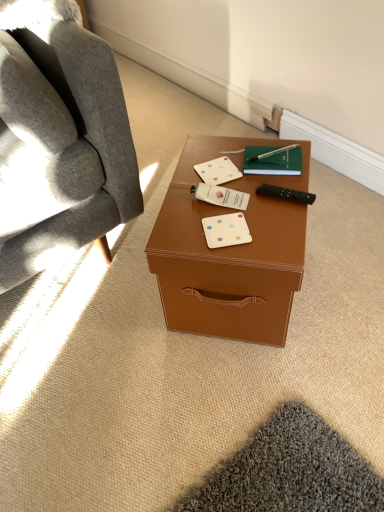
Locate an element on the screen. white matte business card at center, positioned as the second business card in front-to-back order is located at coordinates (221, 196).

This screenshot has width=384, height=512. In order to click on brown leather desk at center in this screenshot , I will do `click(229, 253)`.

This screenshot has height=512, width=384. Describe the element at coordinates (229, 253) in the screenshot. I see `brown leather desk at center` at that location.

The image size is (384, 512). What do you see at coordinates (226, 230) in the screenshot? I see `white matte business card at center, the 3th business card when ordered from back to front` at bounding box center [226, 230].

Identify the location of soft gray fabric chair at left. (59, 140).

Find the location of a particular element. This screenshot has height=512, width=384. green matte notebook at center is located at coordinates (272, 161).

The height and width of the screenshot is (512, 384). I want to click on white matte business card at center, marked as the 2th business card in a back-to-front arrangement, so click(221, 196).

In the image, there is a white matte business card at center, marked as the 2th business card in a back-to-front arrangement. Identify the location of business card above it (from the image's perspective). This screenshot has height=512, width=384. coord(218,170).

Considering their positions, is white matte business card at center, marked as the 2th business card in a back-to-front arrangement, located in front of or behind white matte business card at center, which ranks as the first business card in back-to-front order?

white matte business card at center, marked as the 2th business card in a back-to-front arrangement, is positioned closer to the viewer than white matte business card at center, which ranks as the first business card in back-to-front order.

Consider the image. Is white matte business card at center, the second business card in the top-to-bottom sequence, positioned with its back to white matte business card at center, which ranks as the first business card in back-to-front order?

That's right, white matte business card at center, the second business card in the top-to-bottom sequence, is facing away from white matte business card at center, which ranks as the first business card in back-to-front order.

Could you measure the distance between white matte business card at center, positioned as the second business card in front-to-back order, and white matte business card at center, marked as the first business card in a top-to-bottom arrangement?

2.43 inches.

Considering the points (14, 69) and (208, 255), which point is behind, point (14, 69) or point (208, 255)?

Point (208, 255)

Is brown leather desk at center inside soft gray fabric chair at left?

No, brown leather desk at center is not inside soft gray fabric chair at left.

In terms of width, does soft gray fabric chair at left look wider or thinner when compared to brown leather desk at center?

In the image, soft gray fabric chair at left appears to be wider than brown leather desk at center.

Could you tell me if soft gray fabric chair at left is facing brown leather desk at center?

Yes, soft gray fabric chair at left is facing brown leather desk at center.

Between soft gray fabric chair at left and black plastic remote control at right, which one is positioned behind?

black plastic remote control at right is further away from the camera.

Who is smaller, soft gray fabric chair at left or black plastic remote control at right?

Smaller between the two is black plastic remote control at right.

Does point (36, 52) lie in front of point (279, 186)?

That is True.

Is soft gray fabric chair at left in contact with black plastic remote control at right?

No, soft gray fabric chair at left is not with black plastic remote control at right.

Can you see white matte business card at center, the 3th business card when ordered from back to front, touching soft gray fabric chair at left?

No, white matte business card at center, the 3th business card when ordered from back to front, is not making contact with soft gray fabric chair at left.

From a real-world perspective, does white matte business card at center, the 1th business card viewed from the front, sit lower than soft gray fabric chair at left?

Indeed, from a real-world perspective, white matte business card at center, the 1th business card viewed from the front, is positioned beneath soft gray fabric chair at left.

Consider the image. Is white matte business card at center, which is counted as the first business card, starting from the bottom, positioned behind soft gray fabric chair at left?

Yes, it is.

Is soft gray fabric chair at left located within white matte business card at center, the 1th business card viewed from the front?

No, soft gray fabric chair at left is not inside white matte business card at center, the 1th business card viewed from the front.

Is soft gray fabric chair at left at the back of black plastic remote control at right?

No, black plastic remote control at right is not facing away from soft gray fabric chair at left.

Can you confirm if black plastic remote control at right is smaller than soft gray fabric chair at left?

Correct, black plastic remote control at right occupies less space than soft gray fabric chair at left.

Between black plastic remote control at right and soft gray fabric chair at left, which one is positioned in front?

Positioned in front is soft gray fabric chair at left.

Are black plastic remote control at right and soft gray fabric chair at left making contact?

No, black plastic remote control at right is not making contact with soft gray fabric chair at left.

Between brown leather desk at center and black plastic remote control at right, which one has larger size?

brown leather desk at center is bigger.

From the image's perspective, between brown leather desk at center and black plastic remote control at right, who is located below?

brown leather desk at center appears lower in the image.

Is brown leather desk at center looking in the opposite direction of black plastic remote control at right?

No, brown leather desk at center is not facing away from black plastic remote control at right.

How much distance is there between brown leather desk at center and black plastic remote control at right?

brown leather desk at center and black plastic remote control at right are 8.87 inches apart.

Can you confirm if white matte business card at center, marked as the 2th business card in a back-to-front arrangement, is positioned to the left of soft gray fabric chair at left?

Incorrect, white matte business card at center, marked as the 2th business card in a back-to-front arrangement, is not on the left side of soft gray fabric chair at left.

Could you tell me if white matte business card at center, marked as the 2th business card in a back-to-front arrangement, is turned towards soft gray fabric chair at left?

Result: No, white matte business card at center, marked as the 2th business card in a back-to-front arrangement, does not turn towards soft gray fabric chair at left.

Does point (210, 193) come farther from viewer compared to point (78, 203)?

No.

Identify the location of the 2nd business card below the soft gray fabric chair at left (from the image's perspective). The image size is (384, 512). (221, 196).

Image resolution: width=384 pixels, height=512 pixels. I want to click on business card that is the 2nd object directly below the white matte business card at center, positioned as the second business card in front-to-back order (from a real-world perspective), so click(x=218, y=170).

Locate an element on the screen. desk that is on the right side of soft gray fabric chair at left is located at coordinates (229, 253).

When comparing their distances from white matte business card at center, marked as the first business card in a top-to-bottom arrangement, does white matte business card at center, the 3th business card when ordered from back to front, or white matte business card at center, arranged as the second business card when ordered from the bottom, seem further?

white matte business card at center, the 3th business card when ordered from back to front, is further to white matte business card at center, marked as the first business card in a top-to-bottom arrangement.

Estimate the real-world distances between objects in this image. Which object is further from brown leather desk at center, black plastic remote control at right or white matte business card at center, the 3th business card viewed from the front?

black plastic remote control at right is positioned further to the anchor brown leather desk at center.

Looking at the image, which one is located closer to white matte business card at center, the second business card in the top-to-bottom sequence, white matte business card at center, marked as the first business card in a top-to-bottom arrangement, or green matte notebook at center?

white matte business card at center, marked as the first business card in a top-to-bottom arrangement, is positioned closer to the anchor white matte business card at center, the second business card in the top-to-bottom sequence.

Considering their positions, is brown leather desk at center positioned closer to soft gray fabric chair at left than white matte business card at center, which is counted as the first business card, starting from the bottom?

The object closer to soft gray fabric chair at left is brown leather desk at center.

Looking at the image, which one is located further to black plastic remote control at right, white matte business card at center, the 3th business card viewed from the front, or brown leather desk at center?

brown leather desk at center is further to black plastic remote control at right.

Estimate the real-world distances between objects in this image. Which object is closer to white matte business card at center, placed as the third business card when sorted from top to bottom, brown leather desk at center or black plastic remote control at right?

Among the two, black plastic remote control at right is located nearer to white matte business card at center, placed as the third business card when sorted from top to bottom.

Based on their spatial positions, is white matte business card at center, which is counted as the first business card, starting from the bottom, or black plastic remote control at right closer to soft gray fabric chair at left?

white matte business card at center, which is counted as the first business card, starting from the bottom, lies closer to soft gray fabric chair at left than the other object.

When comparing their distances from green matte notebook at center, does soft gray fabric chair at left or white matte business card at center, marked as the third business card in a bottom-to-top arrangement, seem closer?

white matte business card at center, marked as the third business card in a bottom-to-top arrangement, lies closer to green matte notebook at center than the other object.

Locate an element on the screen. business card between white matte business card at center, the 3th business card viewed from the front, and white matte business card at center, the 3th business card when ordered from back to front, vertically is located at coordinates (221, 196).

Where is `business card between brown leather desk at center and white matte business card at center, arranged as the second business card when ordered from the bottom, from front to back`? The image size is (384, 512). business card between brown leather desk at center and white matte business card at center, arranged as the second business card when ordered from the bottom, from front to back is located at coordinates (226, 230).

Identify the location of desk situated between white matte business card at center, marked as the 2th business card in a back-to-front arrangement, and black plastic remote control at right from left to right. The height and width of the screenshot is (512, 384). (229, 253).

At what (x,y) coordinates should I click in order to perform the action: click on notebook between brown leather desk at center and white matte business card at center, marked as the third business card in a bottom-to-top arrangement, along the z-axis. Please return your answer as a coordinate pair (x, y). Looking at the image, I should click on (272, 161).